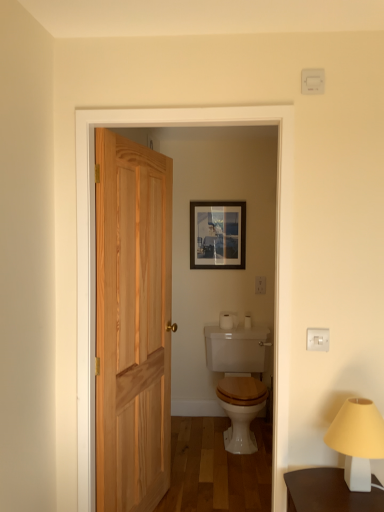
This screenshot has width=384, height=512. What do you see at coordinates (357, 440) in the screenshot? I see `white matte table lamp at lower right` at bounding box center [357, 440].

Where is `matte glass picture frame at center`? The width and height of the screenshot is (384, 512). matte glass picture frame at center is located at coordinates (217, 234).

This screenshot has height=512, width=384. In order to click on white matte toilet paper at center in this screenshot , I will do `click(228, 320)`.

I want to click on door lying above the white glossy toilet at center (from the image's perspective), so pyautogui.click(x=132, y=323).

From the image's perspective, is white glossy toilet at center positioned above or below natural wood door at left?

white glossy toilet at center is below natural wood door at left.

Is white glossy toilet at center turned away from natural wood door at left?

No, white glossy toilet at center is not facing the opposite direction of natural wood door at left.

Between white glossy toilet at center and natural wood door at left, which one has larger width?

With larger width is white glossy toilet at center.

Is matte glass picture frame at center aimed at white matte toilet paper at center?

No, matte glass picture frame at center does not turn towards white matte toilet paper at center.

Relative to white matte toilet paper at center, is matte glass picture frame at center in front or behind?

Clearly, matte glass picture frame at center is behind white matte toilet paper at center.

From their relative heights in the image, would you say white matte table lamp at lower right is taller or shorter than white glossy toilet at center?

In the image, white matte table lamp at lower right appears to be shorter than white glossy toilet at center.

Considering the relative positions of white matte table lamp at lower right and white glossy toilet at center in the image provided, is white matte table lamp at lower right to the left of white glossy toilet at center from the viewer's perspective?

No.

From a real-world perspective, is white matte table lamp at lower right above or below white glossy toilet at center?

white matte table lamp at lower right is above white glossy toilet at center.

Looking at their sizes, would you say white matte table lamp at lower right is wider or thinner than white glossy toilet at center?

Clearly, white matte table lamp at lower right has less width compared to white glossy toilet at center.

From a real-world perspective, between natural wood screen door at center and natural wood door at left, who is vertically higher?

In real-world perspective, natural wood screen door at center is above.

Is natural wood screen door at center smaller than natural wood door at left?

Indeed, natural wood screen door at center has a smaller size compared to natural wood door at left.

Does point (140, 121) come closer to viewer compared to point (120, 217)?

Yes.

In the image, there is a natural wood door at left. Where is `screen door above it (from the image's perspective)`? The width and height of the screenshot is (384, 512). screen door above it (from the image's perspective) is located at coordinates (276, 219).

From the image's perspective, would you say white glossy toilet at center is shown under white matte toilet paper at center?

Indeed, from the image's perspective, white glossy toilet at center is shown beneath white matte toilet paper at center.

Considering the sizes of objects white glossy toilet at center and white matte toilet paper at center in the image provided, who is shorter, white glossy toilet at center or white matte toilet paper at center?

white matte toilet paper at center is shorter.

From a real-world perspective, which is physically below, white glossy toilet at center or white matte toilet paper at center?

white glossy toilet at center is physically lower.

Would you consider white matte table lamp at lower right to be distant from matte glass picture frame at center?

Absolutely, white matte table lamp at lower right is distant from matte glass picture frame at center.

Considering the positions of point (351, 459) and point (243, 221), is point (351, 459) closer or farther from the camera than point (243, 221)?

Point (351, 459).

Visually, is white matte table lamp at lower right positioned to the left or to the right of matte glass picture frame at center?

white matte table lamp at lower right is to the right of matte glass picture frame at center.

How distant is white matte table lamp at lower right from matte glass picture frame at center?

white matte table lamp at lower right is 2.11 meters from matte glass picture frame at center.

Which is closer, (107, 157) or (230, 328)?

Point (107, 157) is positioned closer to the camera compared to point (230, 328).

Is natural wood door at left touching white matte toilet paper at center?

They are not placed beside each other.

In the scene shown: From a real-world perspective, does natural wood door at left sit lower than white matte toilet paper at center?

No.

From the image's perspective, which one is positioned lower, natural wood door at left or white matte toilet paper at center?

white matte toilet paper at center is shown below in the image.

You are a GUI agent. You are given a task and a screenshot of the screen. Output one action in this format:
    pyautogui.click(x=<x>, y=<y>)
    Task: Click on the door in front of the white glossy toilet at center
    The image size is (384, 512).
    Given the screenshot: What is the action you would take?
    pyautogui.click(x=132, y=323)

Identify the location of toilet paper below the matte glass picture frame at center (from a real-world perspective). Image resolution: width=384 pixels, height=512 pixels. (228, 320).

From the picture: When comparing their distances from matte glass picture frame at center, does white matte toilet paper at center or natural wood door at left seem closer?

The object closer to matte glass picture frame at center is white matte toilet paper at center.

Looking at the image, which one is located further to white matte toilet paper at center, matte glass picture frame at center or natural wood screen door at center?

natural wood screen door at center lies further to white matte toilet paper at center than the other object.

Looking at the image, which one is located closer to white matte toilet paper at center, natural wood screen door at center or white glossy toilet at center?

white glossy toilet at center.

Looking at the image, which one is located further to natural wood door at left, matte glass picture frame at center or white matte toilet paper at center?

Based on the image, white matte toilet paper at center appears to be further to natural wood door at left.

From the image, which object appears to be nearer to natural wood screen door at center, natural wood door at left or white glossy toilet at center?

Among the two, natural wood door at left is located nearer to natural wood screen door at center.

Which object lies nearer to the anchor point natural wood screen door at center, white matte toilet paper at center or natural wood door at left?

natural wood door at left is positioned closer to the anchor natural wood screen door at center.

Estimate the real-world distances between objects in this image. Which object is further from natural wood screen door at center, matte glass picture frame at center or white matte table lamp at lower right?

matte glass picture frame at center.

Estimate the real-world distances between objects in this image. Which object is closer to white glossy toilet at center, natural wood screen door at center or natural wood door at left?

Among the two, natural wood door at left is located nearer to white glossy toilet at center.

Locate an element on the screen. The height and width of the screenshot is (512, 384). sink between natural wood door at left and white matte toilet paper at center from front to back is located at coordinates (241, 410).

Where is `screen door located between white matte table lamp at lower right and white glossy toilet at center in the depth direction`? screen door located between white matte table lamp at lower right and white glossy toilet at center in the depth direction is located at coordinates (276, 219).

Identify the location of toilet paper between natural wood screen door at center and matte glass picture frame at center in the front-back direction. (228, 320).

Locate an element on the screen. door between natural wood screen door at center and matte glass picture frame at center from front to back is located at coordinates (132, 323).